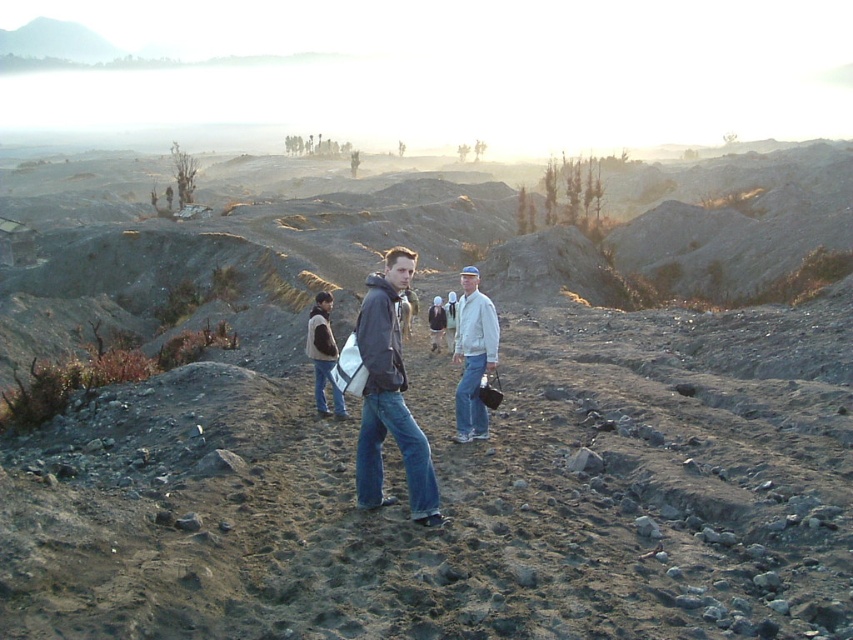
Does white matte jacket at center have a smaller size compared to brown suede vest at center?

Actually, white matte jacket at center might be larger than brown suede vest at center.

Is white matte jacket at center positioned before brown suede vest at center?

Yes, white matte jacket at center is in front of brown suede vest at center.

This screenshot has width=853, height=640. What do you see at coordinates (473, 355) in the screenshot?
I see `white matte jacket at center` at bounding box center [473, 355].

Where is `white matte jacket at center`? This screenshot has width=853, height=640. white matte jacket at center is located at coordinates (473, 355).

Does matte gray jacket at center have a greater height compared to white matte jacket at center?

Yes, matte gray jacket at center is taller than white matte jacket at center.

Consider the image. Does matte gray jacket at center have a lesser height compared to white matte jacket at center?

In fact, matte gray jacket at center may be taller than white matte jacket at center.

Who is more distant from viewer, (x=357, y=324) or (x=474, y=365)?

Point (x=474, y=365)

The height and width of the screenshot is (640, 853). Identify the location of matte gray jacket at center. (389, 396).

Which is more to the left, white matte jacket at center or light gray fabric jacket at center?

light gray fabric jacket at center

Is white matte jacket at center smaller than light gray fabric jacket at center?

Actually, white matte jacket at center might be larger than light gray fabric jacket at center.

Does point (469, 397) come closer to viewer compared to point (433, 298)?

Yes, point (469, 397) is closer to viewer.

At what (x,y) coordinates should I click in order to perform the action: click on white matte jacket at center. Please return your answer as a coordinate pair (x, y). This screenshot has height=640, width=853. Looking at the image, I should click on (473, 355).